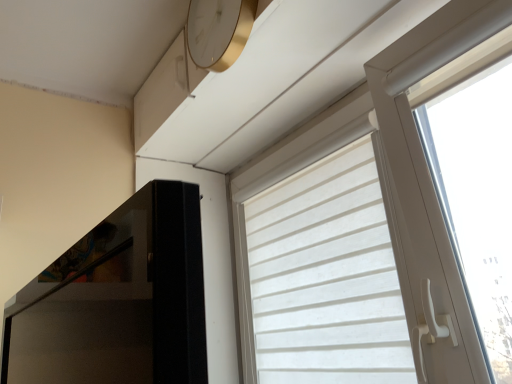
Question: From the image's perspective, is white matte window at upper right above or below white fabric curtain at upper right?

Choices:
 (A) above
 (B) below

Answer: (A)

Question: From a real-world perspective, is white matte window at upper right physically located above or below white fabric curtain at upper right?

Choices:
 (A) below
 (B) above

Answer: (B)

Question: Considering the real-world distances, which object is closest to the gold metallic clock at upper center?

Choices:
 (A) white matte window at upper right
 (B) white fabric curtain at upper right

Answer: (A)

Question: Considering the real-world distances, which object is closest to the white matte window at upper right?

Choices:
 (A) gold metallic clock at upper center
 (B) white fabric curtain at upper right

Answer: (B)